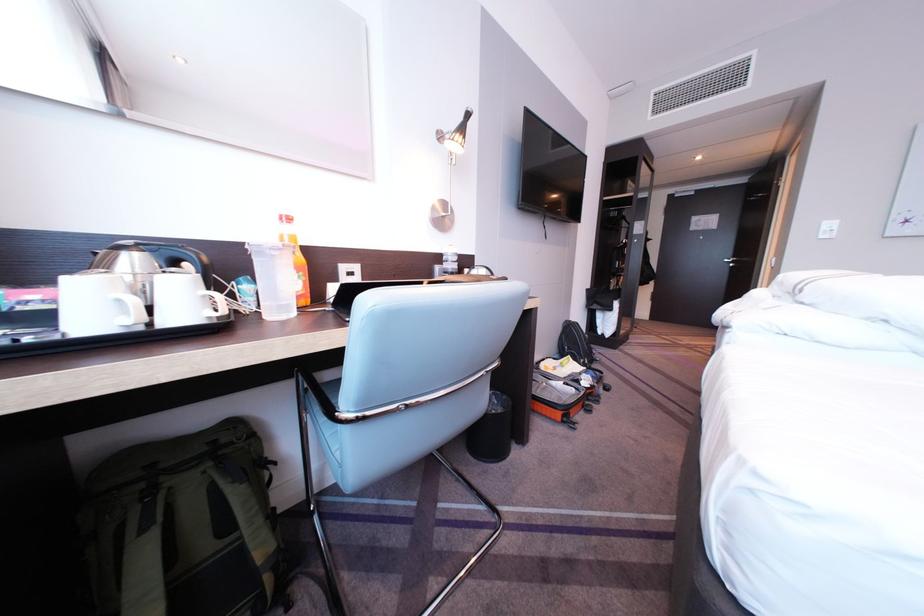
At what (x,y) coordinates should I click in order to perform the action: click on black trash can. Please return your answer as a coordinate pair (x, y). The width and height of the screenshot is (924, 616). Looking at the image, I should click on (492, 431).